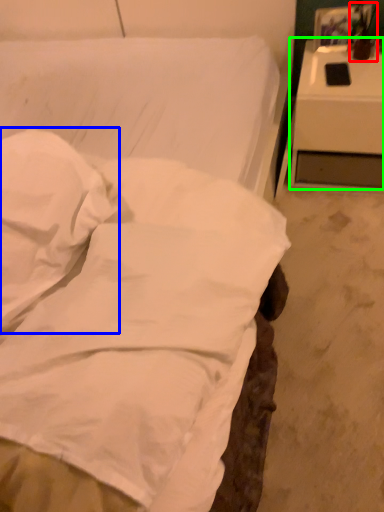
Question: Based on their relative distances, which object is farther from table lamp (highlighted by a red box)? Choose from pillow (highlighted by a blue box) and nightstand (highlighted by a green box).

Choices:
 (A) pillow
 (B) nightstand

Answer: (A)